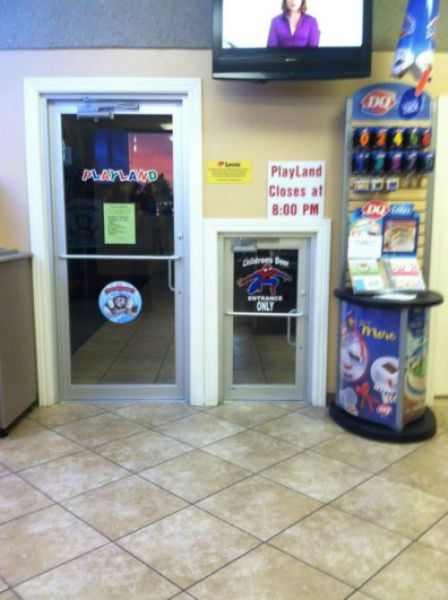
Where is `doors`? doors is located at coordinates (136, 275), (241, 362).